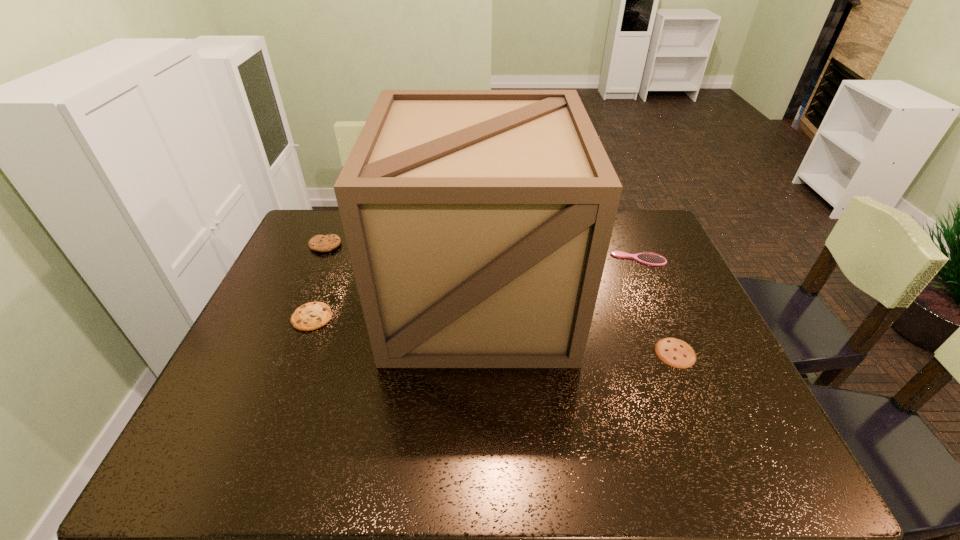
At what (x,y) coordinates should I click in order to perform the action: click on the tallest object. Please return your answer as a coordinate pair (x, y). The width and height of the screenshot is (960, 540). Looking at the image, I should click on (478, 222).

Image resolution: width=960 pixels, height=540 pixels. I want to click on the third object from left to right, so click(x=478, y=222).

Identify the location of the tallest cookie. The height and width of the screenshot is (540, 960). (320, 243).

Where is `the fourth shortest object`? The image size is (960, 540). the fourth shortest object is located at coordinates (320, 243).

This screenshot has height=540, width=960. Identify the location of the third tallest object. (648, 258).

Identify the location of the second farthest cookie. (313, 315).

You are a GUI agent. You are given a task and a screenshot of the screen. Output one action in this format:
    pyautogui.click(x=<x>, y=<y>)
    Task: Click on the second tallest cookie
    This screenshot has height=540, width=960.
    Given the screenshot: What is the action you would take?
    pyautogui.click(x=313, y=315)

Find the location of a particular element. This screenshot has height=540, width=960. the rightmost cookie is located at coordinates (674, 352).

Locate an element on the screen. The image size is (960, 540). the nearest cookie is located at coordinates (674, 352).

The image size is (960, 540). I want to click on free location located 0.180m on the front of the box, so click(x=478, y=436).